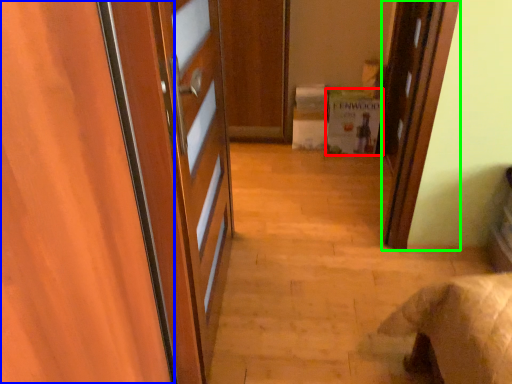
Question: Which is farther away from cabinetry (highlighted by a red box)? door (highlighted by a blue box) or door (highlighted by a green box)?

Choices:
 (A) door
 (B) door

Answer: (A)